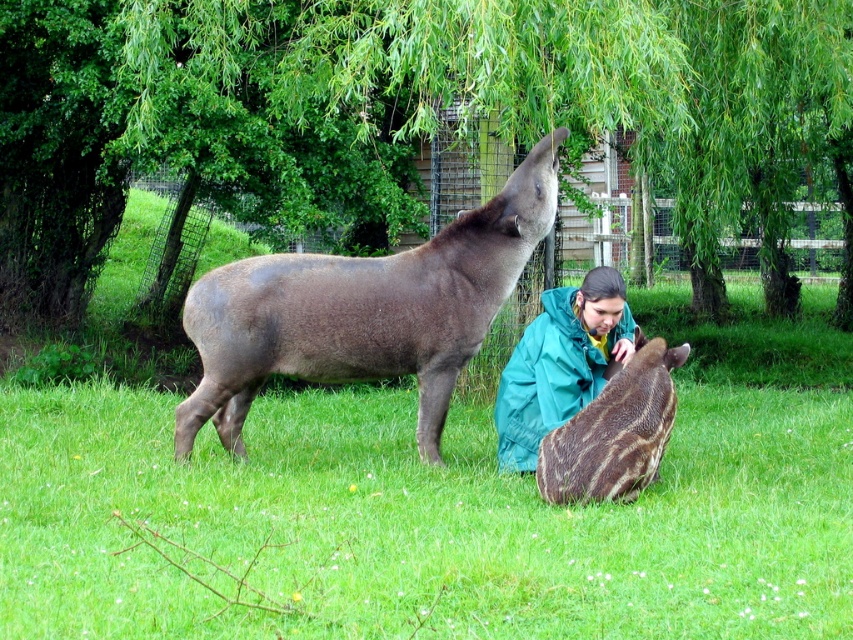
Question: Does green grass at center come behind green leafy tree at upper center?

Choices:
 (A) yes
 (B) no

Answer: (B)

Question: Can you confirm if green grass at center is bigger than green leafy tree at upper center?

Choices:
 (A) yes
 (B) no

Answer: (B)

Question: Which object appears closest to the camera in this image?

Choices:
 (A) teal fabric jacket at center
 (B) green leafy tree at upper center

Answer: (B)

Question: Which point is closer to the camera?

Choices:
 (A) teal fabric jacket at center
 (B) green grass at center
 (C) green leafy tree at upper center
 (D) brown matte tapir at center

Answer: (B)

Question: Is green grass at center to the left of brown matte tapir at center from the viewer's perspective?

Choices:
 (A) no
 (B) yes

Answer: (A)

Question: Among these points, which one is farthest from the camera?

Choices:
 (A) (300, 449)
 (B) (606, 428)
 (C) (320, 339)
 (D) (590, 349)

Answer: (A)